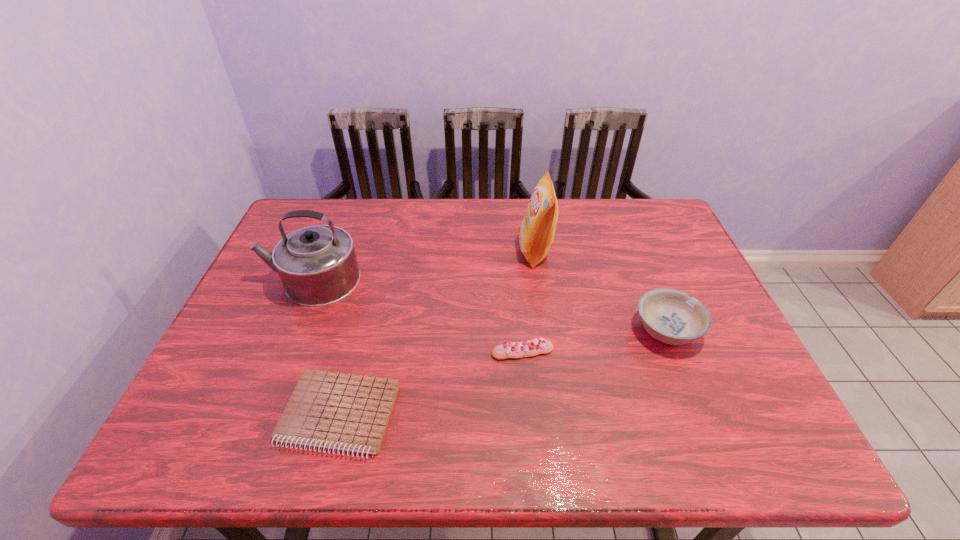
The height and width of the screenshot is (540, 960). Find the location of `vacant space at the near left corner of the desktop`. vacant space at the near left corner of the desktop is located at coordinates (233, 453).

Where is `vacant region at the far right corner`? vacant region at the far right corner is located at coordinates click(x=655, y=224).

The image size is (960, 540). I want to click on vacant area at the near right corner of the desktop, so click(x=722, y=422).

This screenshot has height=540, width=960. Identify the location of empty space between the crisp (potato chip) and the kettle. (423, 266).

Where is `free area in between the eclair and the kettle`? This screenshot has width=960, height=540. free area in between the eclair and the kettle is located at coordinates (417, 316).

Identify the location of free space between the fourth tallest object and the rightmost object. This screenshot has width=960, height=540. (594, 341).

Where is `free spot between the shortest object and the crisp (potato chip)`? free spot between the shortest object and the crisp (potato chip) is located at coordinates (438, 333).

Where is `vacant area that lies between the second shortest object and the bowl`? This screenshot has height=540, width=960. vacant area that lies between the second shortest object and the bowl is located at coordinates (594, 341).

Locate an element on the screen. Image resolution: width=960 pixels, height=540 pixels. free space between the eclair and the nearest object is located at coordinates (431, 383).

Where is `free spot between the bowl and the kettle`? Image resolution: width=960 pixels, height=540 pixels. free spot between the bowl and the kettle is located at coordinates (489, 305).